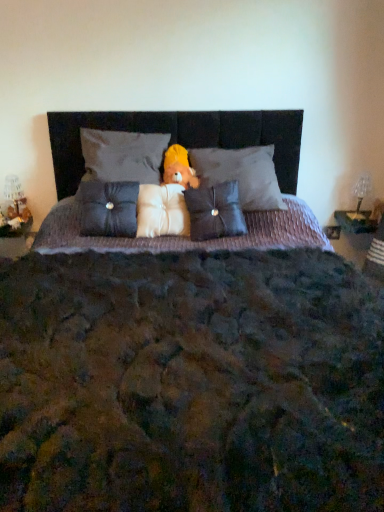
Image resolution: width=384 pixels, height=512 pixels. What are the coordinates of `velvet gray pillow at upper center, positioned as the 2th pillow in left-to-right order` in the screenshot? It's located at (123, 155).

What do you see at coordinates (123, 155) in the screenshot?
I see `velvet gray pillow at upper center, which ranks as the 4th pillow in right-to-left order` at bounding box center [123, 155].

What do you see at coordinates (241, 174) in the screenshot?
I see `velvet gray pillow at center, the 5th pillow when ordered from left to right` at bounding box center [241, 174].

Identify the location of white plush pillow at center, placed as the third pillow when sorted from right to left. This screenshot has height=512, width=384. (162, 211).

Is the surface of white plush pillow at center, placed as the third pillow when sorted from right to left, in direct contact with velvet gray pillow at upper center, positioned as the 2th pillow in left-to-right order?

No, white plush pillow at center, placed as the third pillow when sorted from right to left, is not making contact with velvet gray pillow at upper center, positioned as the 2th pillow in left-to-right order.

From a real-world perspective, which object stands above the other?

From a 3D spatial view, velvet gray pillow at upper center, which ranks as the 4th pillow in right-to-left order, is above.

From the picture: Is white plush pillow at center, placed as the third pillow when sorted from right to left, thinner than velvet gray pillow at upper center, positioned as the 2th pillow in left-to-right order?

Yes.

Which is farther from the camera, (162,194) or (159,177)?

Point (159,177)

How many degrees apart are the facing directions of satin dark gray pillow at center, positioned as the fourth pillow in left-to-right order, and white plush pillow at center, placed as the third pillow when sorted from right to left?

There is a 20.6-degree angle between the facing directions of satin dark gray pillow at center, positioned as the fourth pillow in left-to-right order, and white plush pillow at center, placed as the third pillow when sorted from right to left.

From a real-world perspective, which is physically below, satin dark gray pillow at center, arranged as the 2th pillow when viewed from the right, or white plush pillow at center, placed as the third pillow when sorted from left to right?

From a 3D spatial view, white plush pillow at center, placed as the third pillow when sorted from left to right, is below.

Is satin dark gray pillow at center, positioned as the fourth pillow in left-to-right order, outside of white plush pillow at center, placed as the third pillow when sorted from left to right?

Yes, satin dark gray pillow at center, positioned as the fourth pillow in left-to-right order, is located beyond the bounds of white plush pillow at center, placed as the third pillow when sorted from left to right.

Which object is closer to the camera taking this photo, clear glass table lamp at right or velvet gray pillow at upper center, which ranks as the 4th pillow in right-to-left order?

Positioned in front is velvet gray pillow at upper center, which ranks as the 4th pillow in right-to-left order.

Does point (349, 217) appear closer or farther from the camera than point (138, 136)?

Point (349, 217) appears to be farther away from the viewer than point (138, 136).

Could you tell me if clear glass table lamp at right is facing velvet gray pillow at upper center, which ranks as the 4th pillow in right-to-left order?

No, clear glass table lamp at right is not aimed at velvet gray pillow at upper center, which ranks as the 4th pillow in right-to-left order.

Considering the relative sizes of clear glass table lamp at right and velvet gray pillow at upper center, positioned as the 2th pillow in left-to-right order, in the image provided, is clear glass table lamp at right wider than velvet gray pillow at upper center, positioned as the 2th pillow in left-to-right order,?

No, clear glass table lamp at right is not wider than velvet gray pillow at upper center, positioned as the 2th pillow in left-to-right order.

Between velvet gray pillow at upper center, which ranks as the 4th pillow in right-to-left order, and satin dark gray pillow at center, arranged as the 2th pillow when viewed from the right, which one has less height?

Standing shorter between the two is velvet gray pillow at upper center, which ranks as the 4th pillow in right-to-left order.

Which is closer to the camera, (x=109, y=155) or (x=198, y=205)?

The point (x=198, y=205) is closer.

From the image's perspective, which one is positioned lower, velvet gray pillow at upper center, positioned as the 2th pillow in left-to-right order, or satin dark gray pillow at center, arranged as the 2th pillow when viewed from the right?

satin dark gray pillow at center, arranged as the 2th pillow when viewed from the right.

Would you say velvet gray pillow at center, positioned as the 1th pillow in right-to-left order, is inside or outside satin dark gray pillow at center, positioned as the fourth pillow in left-to-right order?

velvet gray pillow at center, positioned as the 1th pillow in right-to-left order, is not inside satin dark gray pillow at center, positioned as the fourth pillow in left-to-right order, it's outside.

Considering the sizes of objects velvet gray pillow at center, the 5th pillow when ordered from left to right, and satin dark gray pillow at center, positioned as the fourth pillow in left-to-right order, in the image provided, who is shorter, velvet gray pillow at center, the 5th pillow when ordered from left to right, or satin dark gray pillow at center, positioned as the fourth pillow in left-to-right order,?

Standing shorter between the two is satin dark gray pillow at center, positioned as the fourth pillow in left-to-right order.

Considering the positions of objects velvet gray pillow at center, positioned as the 1th pillow in right-to-left order, and satin dark gray pillow at center, positioned as the fourth pillow in left-to-right order, in the image provided, who is in front, velvet gray pillow at center, positioned as the 1th pillow in right-to-left order, or satin dark gray pillow at center, positioned as the fourth pillow in left-to-right order,?

satin dark gray pillow at center, positioned as the fourth pillow in left-to-right order.

Consider the image. Can you tell me how much velvet gray pillow at center, positioned as the 1th pillow in right-to-left order, and yellow plush bear at center differ in facing direction?

velvet gray pillow at center, positioned as the 1th pillow in right-to-left order, and yellow plush bear at center are facing 4.19 degrees away from each other.

Consider the image. Considering the relative positions of velvet gray pillow at center, positioned as the 1th pillow in right-to-left order, and yellow plush bear at center in the image provided, is velvet gray pillow at center, positioned as the 1th pillow in right-to-left order, to the left of yellow plush bear at center from the viewer's perspective?

Incorrect, velvet gray pillow at center, positioned as the 1th pillow in right-to-left order, is not on the left side of yellow plush bear at center.

Is velvet gray pillow at center, the 5th pillow when ordered from left to right, inside or outside of yellow plush bear at center?

velvet gray pillow at center, the 5th pillow when ordered from left to right, is not enclosed by yellow plush bear at center.

Considering the relative positions of velvet gray pillow at center, positioned as the 1th pillow in right-to-left order, and yellow plush bear at center in the image provided, is velvet gray pillow at center, positioned as the 1th pillow in right-to-left order, behind yellow plush bear at center?

No, it is in front of yellow plush bear at center.

Looking at the image, does satin dark gray pillow at center, arranged as the 2th pillow when viewed from the right, seem bigger or smaller compared to satin dark gray pillow at center, marked as the 5th pillow in a right-to-left arrangement?

Clearly, satin dark gray pillow at center, arranged as the 2th pillow when viewed from the right, is smaller in size than satin dark gray pillow at center, marked as the 5th pillow in a right-to-left arrangement.

How different are the orientations of satin dark gray pillow at center, positioned as the fourth pillow in left-to-right order, and satin dark gray pillow at center, placed as the first pillow when sorted from left to right, in degrees?

6.14 degrees separate the facing orientations of satin dark gray pillow at center, positioned as the fourth pillow in left-to-right order, and satin dark gray pillow at center, placed as the first pillow when sorted from left to right.

Does satin dark gray pillow at center, positioned as the fourth pillow in left-to-right order, have a lesser width compared to satin dark gray pillow at center, marked as the 5th pillow in a right-to-left arrangement?

Yes.

Would you consider satin dark gray pillow at center, arranged as the 2th pillow when viewed from the right, to be distant from satin dark gray pillow at center, marked as the 5th pillow in a right-to-left arrangement?

No, satin dark gray pillow at center, arranged as the 2th pillow when viewed from the right, is not far from satin dark gray pillow at center, marked as the 5th pillow in a right-to-left arrangement.

From the white plush pillow at center, placed as the third pillow when sorted from right to left, count the 1st pillow to the left and point to it. Please provide its 2D coordinates.

[(123, 155)]

This screenshot has height=512, width=384. What are the coordinates of `the 1st pillow to the right of the white plush pillow at center, placed as the third pillow when sorted from left to right, starting your count from the anchor` in the screenshot? It's located at (215, 212).

Which object lies nearer to the anchor point velvet gray pillow at upper center, which ranks as the 4th pillow in right-to-left order, white plush pillow at center, placed as the third pillow when sorted from left to right, or clear glass table lamp at right?

white plush pillow at center, placed as the third pillow when sorted from left to right, is closer to velvet gray pillow at upper center, which ranks as the 4th pillow in right-to-left order.

Estimate the real-world distances between objects in this image. Which object is further from satin dark gray pillow at center, marked as the 5th pillow in a right-to-left arrangement, velvet gray pillow at center, positioned as the 1th pillow in right-to-left order, or yellow plush bear at center?

The object further to satin dark gray pillow at center, marked as the 5th pillow in a right-to-left arrangement, is velvet gray pillow at center, positioned as the 1th pillow in right-to-left order.

Based on their spatial positions, is white plush pillow at center, placed as the third pillow when sorted from right to left, or velvet gray pillow at center, positioned as the 1th pillow in right-to-left order, further from satin dark gray pillow at center, placed as the first pillow when sorted from left to right?

The object further to satin dark gray pillow at center, placed as the first pillow when sorted from left to right, is velvet gray pillow at center, positioned as the 1th pillow in right-to-left order.

In the scene shown: Considering their positions, is velvet gray pillow at center, the 5th pillow when ordered from left to right, positioned further to satin dark gray pillow at center, positioned as the fourth pillow in left-to-right order, than clear glass table lamp at right?

Among the two, clear glass table lamp at right is located further to satin dark gray pillow at center, positioned as the fourth pillow in left-to-right order.

In the scene shown: Which object lies nearer to the anchor point velvet gray pillow at upper center, positioned as the 2th pillow in left-to-right order, white plush pillow at center, placed as the third pillow when sorted from left to right, or yellow plush bear at center?

yellow plush bear at center lies closer to velvet gray pillow at upper center, positioned as the 2th pillow in left-to-right order, than the other object.

When comparing their distances from velvet gray pillow at center, positioned as the 1th pillow in right-to-left order, does satin dark gray pillow at center, arranged as the 2th pillow when viewed from the right, or velvet gray pillow at upper center, which ranks as the 4th pillow in right-to-left order, seem closer?

satin dark gray pillow at center, arranged as the 2th pillow when viewed from the right.

When comparing their distances from clear glass table lamp at right, does yellow plush bear at center or white plush pillow at center, placed as the third pillow when sorted from left to right, seem further?

Among the two, white plush pillow at center, placed as the third pillow when sorted from left to right, is located further to clear glass table lamp at right.

Considering their positions, is clear glass table lamp at right positioned closer to satin dark gray pillow at center, marked as the 5th pillow in a right-to-left arrangement, than velvet gray pillow at upper center, positioned as the 2th pillow in left-to-right order?

velvet gray pillow at upper center, positioned as the 2th pillow in left-to-right order, is closer to satin dark gray pillow at center, marked as the 5th pillow in a right-to-left arrangement.

Find the location of a particular element. This screenshot has width=384, height=512. pillow located between velvet gray pillow at upper center, which ranks as the 4th pillow in right-to-left order, and yellow plush bear at center in the left-right direction is located at coordinates (162, 211).

The height and width of the screenshot is (512, 384). I want to click on figurine situated between velvet gray pillow at upper center, positioned as the 2th pillow in left-to-right order, and clear glass table lamp at right from left to right, so click(178, 168).

You are a GUI agent. You are given a task and a screenshot of the screen. Output one action in this format:
    pyautogui.click(x=<x>, y=<y>)
    Task: Click on the figurine between white plush pillow at center, placed as the third pillow when sorted from left to right, and clear glass table lamp at right from left to right
    The height and width of the screenshot is (512, 384).
    Given the screenshot: What is the action you would take?
    pyautogui.click(x=178, y=168)

Find the location of a particular element. The height and width of the screenshot is (512, 384). pillow between white plush pillow at center, placed as the third pillow when sorted from left to right, and velvet gray pillow at center, positioned as the 1th pillow in right-to-left order is located at coordinates (215, 212).